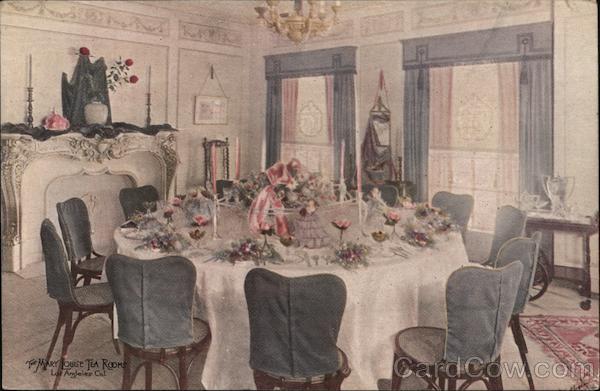
You are a GUI agent. You are given a task and a screenshot of the screen. Output one action in this format:
    pyautogui.click(x=<x>, y=<y>)
    Task: Click on the curtain
    This screenshot has height=391, width=600.
    Given the screenshot: What is the action you would take?
    pyautogui.click(x=538, y=128)